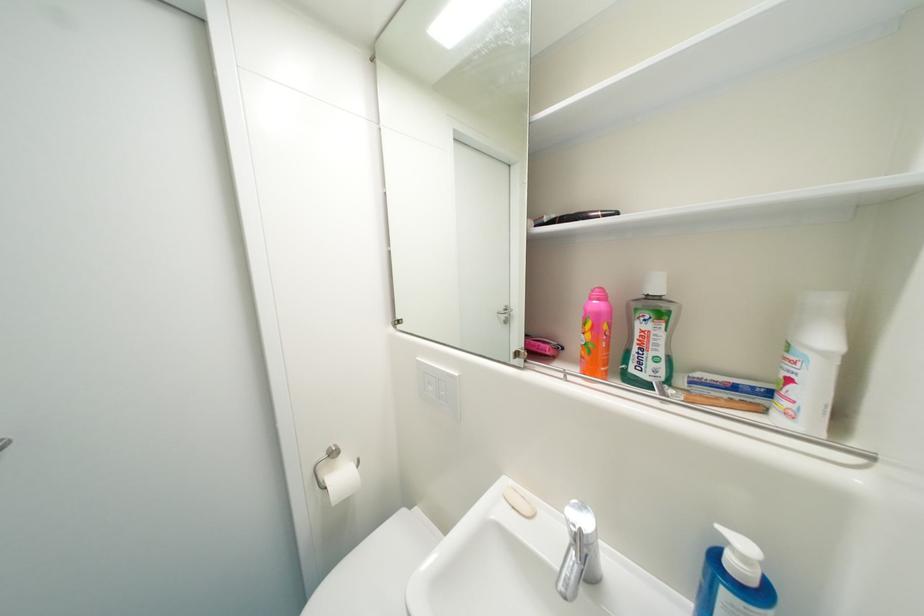
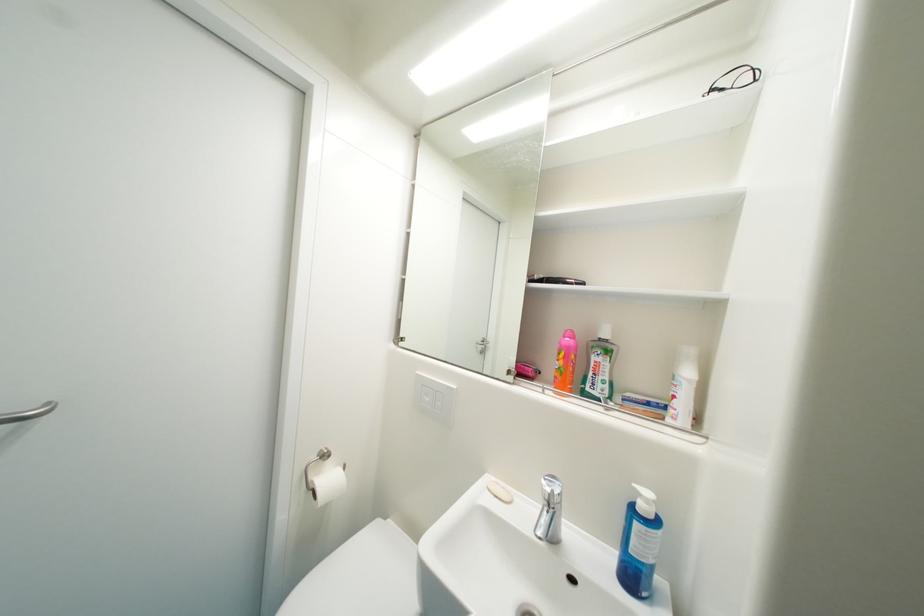
In the second image, find the point that corresponds to pixel 598 347 in the first image.

(569, 371)